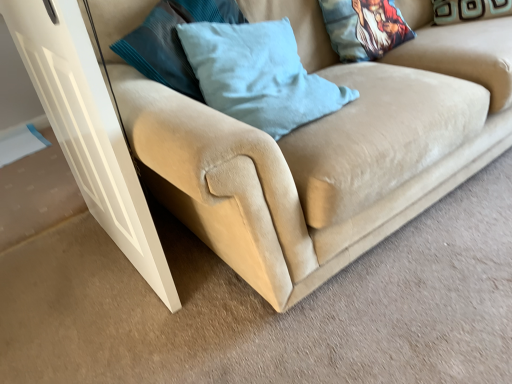
Where is `vacant space to the right of white glossy door at lower left`? The width and height of the screenshot is (512, 384). vacant space to the right of white glossy door at lower left is located at coordinates (214, 272).